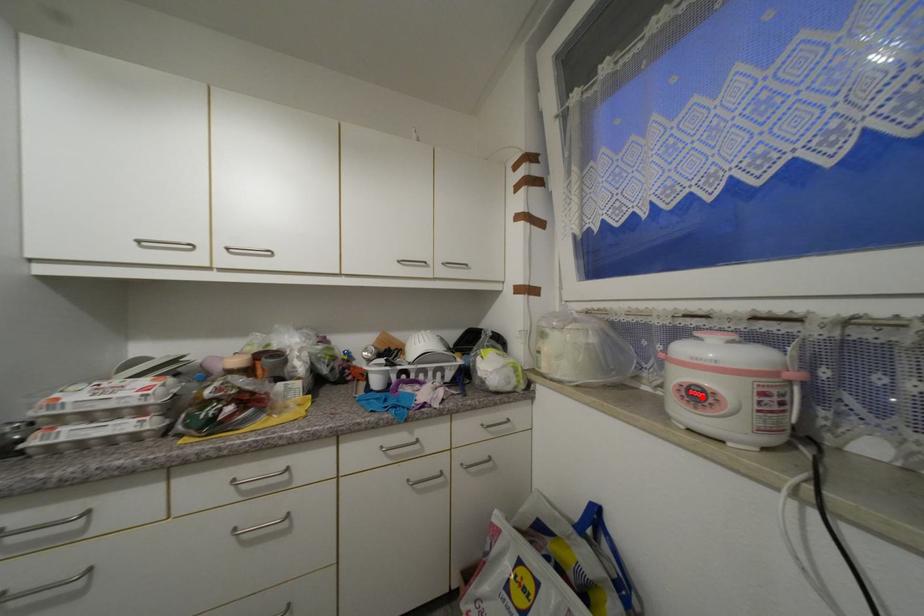
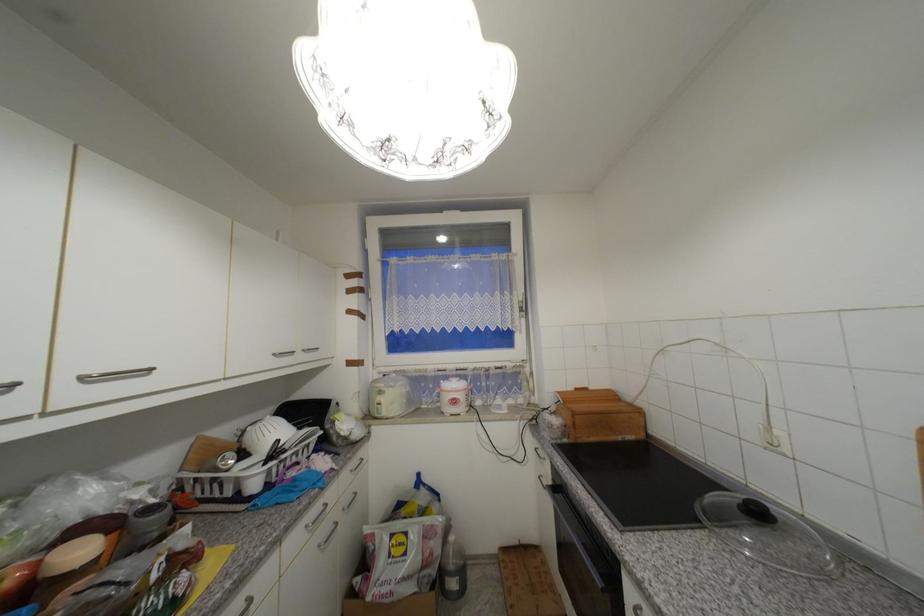
Question: I am providing you with two images of the same scene from different viewpoints. Given a red point in image1, look at the same physical point in image2. Is it:

Choices:
 (A) Closer to the viewpoint
 (B) Farther from the viewpoint

Answer: (B)